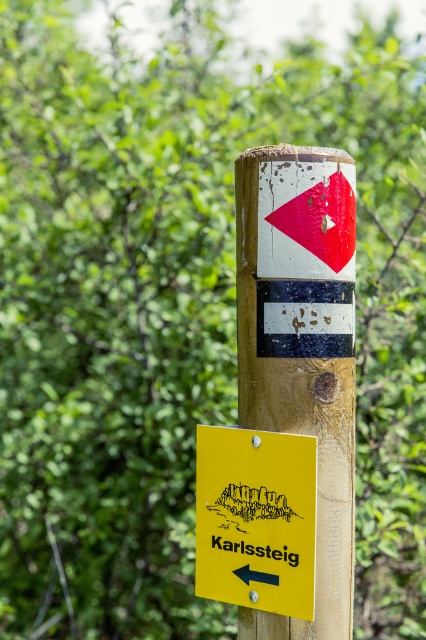
Question: Is wooden signpost at center wider than yellow matte sign at lower left?

Choices:
 (A) no
 (B) yes

Answer: (A)

Question: Is yellow matte sign at lower left wider than black rubber arrow at lower left?

Choices:
 (A) yes
 (B) no

Answer: (A)

Question: Which point is closer to the camera?

Choices:
 (A) black rubber arrow at lower left
 (B) wooden signpost at center
 (C) yellow matte sign at lower left

Answer: (C)

Question: In this image, where is wooden signpost at center located relative to yellow matte sign at lower left?

Choices:
 (A) left
 (B) right

Answer: (B)

Question: Among these objects, which one is nearest to the camera?

Choices:
 (A) black rubber arrow at lower left
 (B) yellow matte sign at lower left

Answer: (B)

Question: Which object is the closest to the wooden signpost at center?

Choices:
 (A) black rubber arrow at lower left
 (B) yellow matte sign at lower left

Answer: (B)